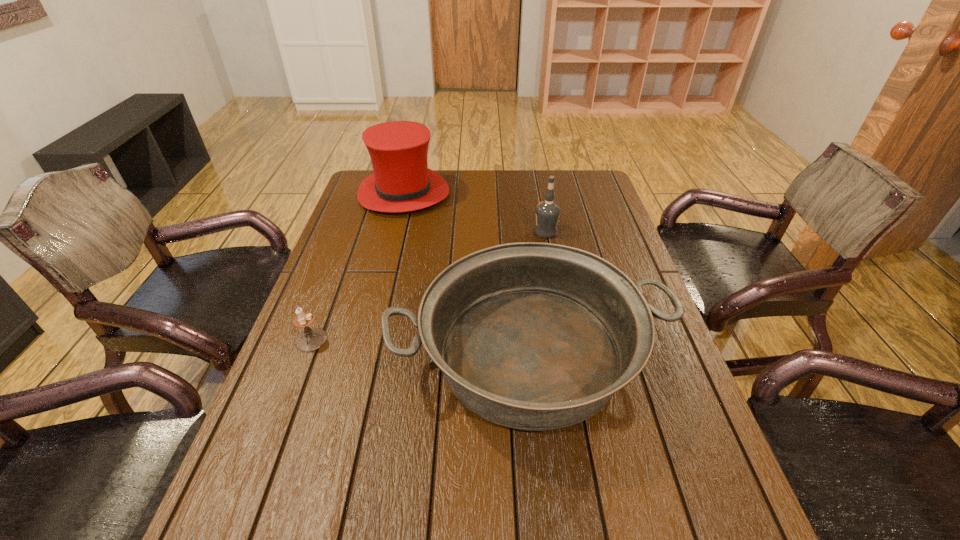
Find the location of `object at the far edge`. object at the far edge is located at coordinates (402, 182).

This screenshot has height=540, width=960. In order to click on hat at the left edge in this screenshot , I will do tap(402, 182).

In order to click on candle holder that is at the left edge in this screenshot , I will do `click(311, 339)`.

At what (x,y) coordinates should I click in order to perform the action: click on object that is at the right edge. Please return your answer as a coordinate pair (x, y). This screenshot has height=540, width=960. Looking at the image, I should click on (533, 336).

Locate an element on the screen. object at the far left corner is located at coordinates (402, 182).

The width and height of the screenshot is (960, 540). What are the coordinates of `vacant space at the far edge of the desktop` in the screenshot? It's located at (536, 184).

Where is `vacant region at the right edge`? This screenshot has height=540, width=960. vacant region at the right edge is located at coordinates (591, 223).

In the image, there is a desktop. Where is `vacant space at the far left corner`? vacant space at the far left corner is located at coordinates (358, 186).

The height and width of the screenshot is (540, 960). In order to click on vacant area at the far right corner of the desktop in this screenshot , I will do `click(589, 172)`.

This screenshot has width=960, height=540. In order to click on free area in between the shortest object and the second shortest object in this screenshot , I will do `click(420, 348)`.